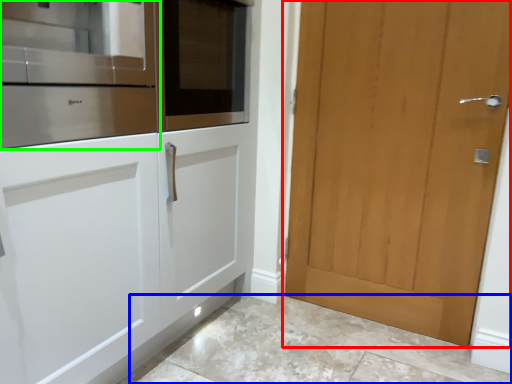
Question: Which object is positioned farthest from door (highlighted by a red box)? Select from granite (highlighted by a blue box) and cabinetry (highlighted by a green box).

Choices:
 (A) granite
 (B) cabinetry

Answer: (B)